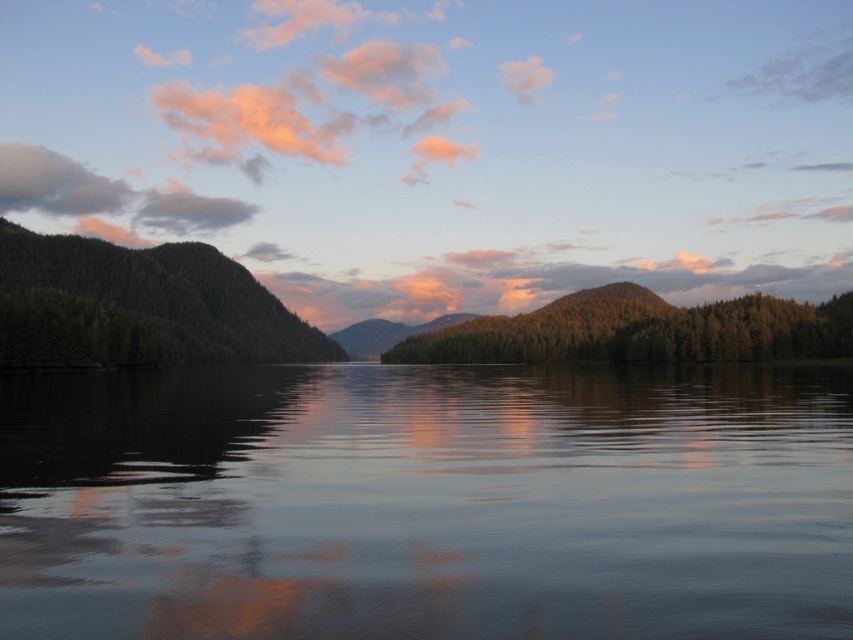
Does smooth reflective water at center come in front of green textured forest at center?

Yes, it is in front of green textured forest at center.

Does point (337, 509) come in front of point (393, 360)?

Yes, it is in front of point (393, 360).

Locate an element on the screen. smooth reflective water at center is located at coordinates (426, 502).

Can you confirm if green matte forest at left is smaller than green textured forest at center?

Incorrect, green matte forest at left is not smaller in size than green textured forest at center.

Where is `green matte forest at left`? The width and height of the screenshot is (853, 640). green matte forest at left is located at coordinates (138, 305).

Which of these two, smooth reflective water at center or green matte forest at left, stands taller?

With more height is green matte forest at left.

From the picture: Between smooth reflective water at center and green matte forest at left, which one has less height?

smooth reflective water at center

Is point (206, 390) closer to viewer compared to point (4, 307)?

That is True.

You are a GUI agent. You are given a task and a screenshot of the screen. Output one action in this format:
    pyautogui.click(x=<x>, y=<y>)
    Task: Click on the smooth reflective water at center
    The image size is (853, 640).
    Given the screenshot: What is the action you would take?
    pyautogui.click(x=426, y=502)